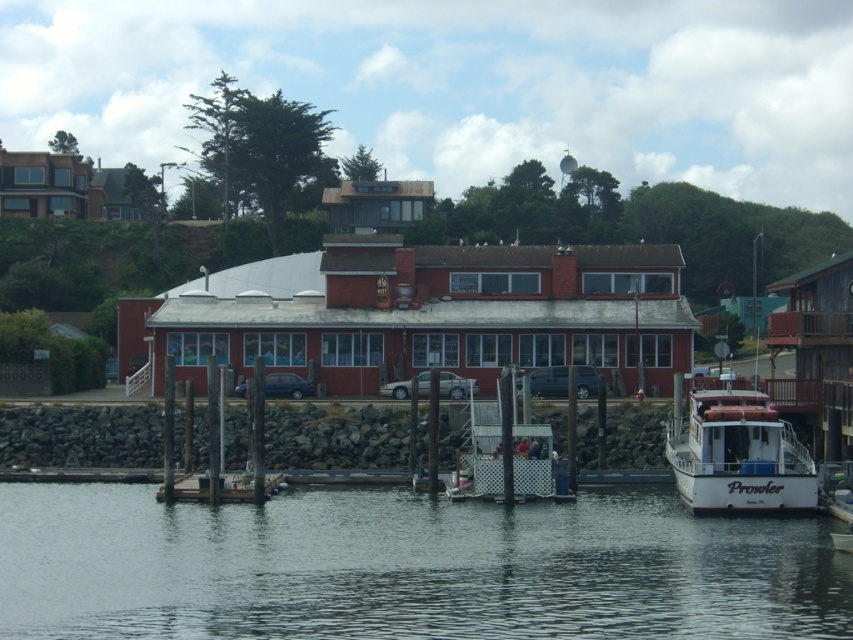
You are standing on the dock and want to check the water level. Where exactly is the transparent water at lower center located in the image?

The transparent water at lower center is located at point coordinates of 0.887 on the x axis and 0.478 on the y axis.

Looking at this image, you are a photographer planning to capture the waterfront scene. You want to ensure that both the transparent water at lower center and the white matte boat at lower right are clearly visible in your shot. Given their sizes, which one should you focus on to ensure it takes up more space in the frame?

The transparent water at lower center is larger in size than the white matte boat at lower right, so focusing on it will ensure it takes up more space in the frame.